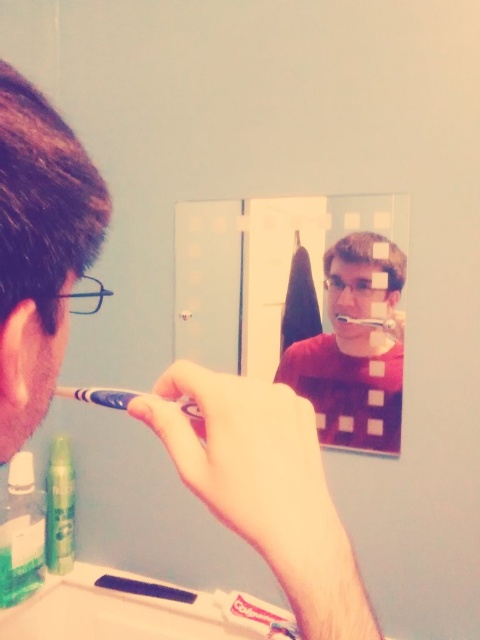
Based on the photo, you are standing in a bathroom and want to take a photo of the scene using your phone camera. The camera is 1.61 meters away from the point at coordinates (222, 609). If your phone has a 50mm lens, will the entire scene fit in the photo?

The camera is 1.61 meters away from the point at coordinates (222, 609). With a 50mm lens, the field of view would depend on the sensor size. However, since the distance is relatively close, it is possible that the entire scene may not fit within the frame. To ensure the entire scene is captured, you might need to use a wider lens or step back further.

You are standing in a bathroom and want to place a small decorative item exactly at the point marked as point (190,410). Given that the recommended safe distance for placing such items is at least 20 inches from the viewer to avoid accidental knocks, is this placement safe?

The distance of point (190,410) from viewer is 19.04 inches, which is less than the recommended 20 inches. Therefore, placing the item here may not be safe as it is too close to the viewer.

You are a dentist examining a patient who has two toothbrushes in their bathroom. The patient mentions they want to replace the toothbrush they use least frequently. Based on the image, which toothbrush is positioned closer to the sink edge where it might collect more dust? Please choose between the blue plastic toothbrush at center and the white plastic toothbrush at center.

The blue plastic toothbrush at center is in front of the white plastic toothbrush at center, so it is closer to the sink edge and more likely to collect dust.